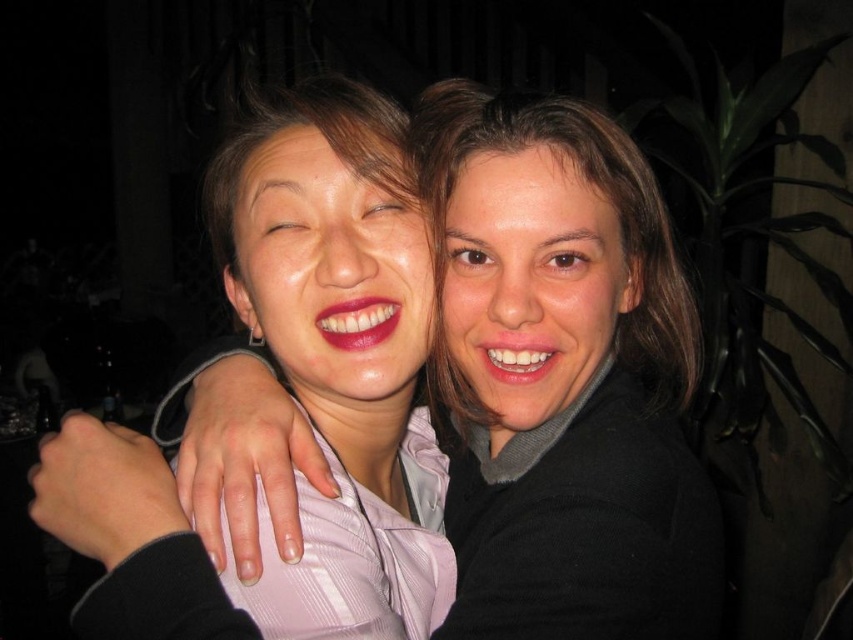
In the scene shown: Is matte pink shirt at center positioned at the back of smooth brown hair at center?

No.

From the picture: Does matte pink shirt at center have a larger size compared to smooth brown hair at center?

No.

Find the location of a particular element. matte pink shirt at center is located at coordinates (340, 355).

You are a GUI agent. You are given a task and a screenshot of the screen. Output one action in this format:
    pyautogui.click(x=<x>, y=<y>)
    Task: Click on the matte pink shirt at center
    
    Given the screenshot: What is the action you would take?
    pyautogui.click(x=340, y=355)